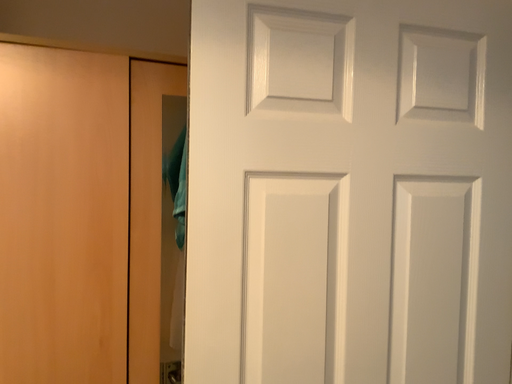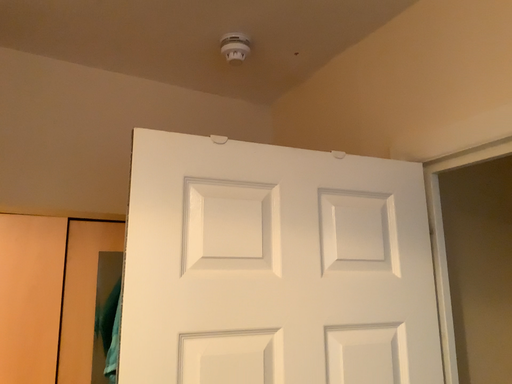
Question: How did the camera likely rotate when shooting the video?

Choices:
 (A) rotated left
 (B) rotated right

Answer: (B)